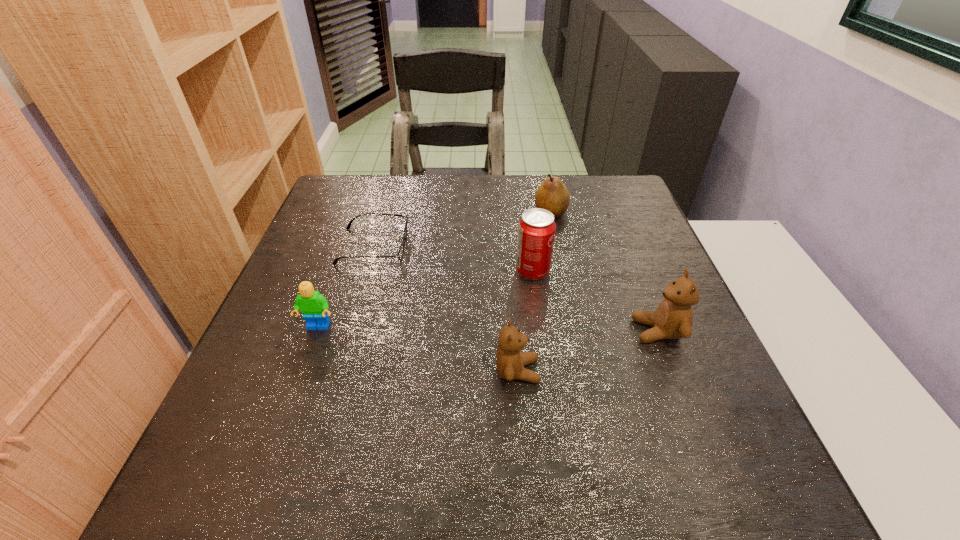
You are a GUI agent. You are given a task and a screenshot of the screen. Output one action in this format:
    pyautogui.click(x=<x>, y=<y>)
    Task: Click on the free region at the far edge of the desktop
    This screenshot has height=540, width=960.
    Given the screenshot: What is the action you would take?
    pyautogui.click(x=455, y=217)

The image size is (960, 540). Identify the location of free space at the near edge of the desktop. (384, 434).

Image resolution: width=960 pixels, height=540 pixels. In the image, there is a desktop. In order to click on free region at the left edge in this screenshot , I will do tap(358, 239).

Image resolution: width=960 pixels, height=540 pixels. Identify the location of free space at the right edge of the desktop. (604, 275).

In the image, there is a desktop. Where is `vacant space at the far left corner`? vacant space at the far left corner is located at coordinates click(378, 189).

I want to click on vacant space at the far right corner of the desktop, so click(x=585, y=214).

This screenshot has width=960, height=540. In order to click on empty space that is in between the shorter teddy bear and the taller teddy bear in this screenshot , I will do `click(588, 351)`.

Locate an element on the screen. Image resolution: width=960 pixels, height=540 pixels. free space between the Lego and the shorter teddy bear is located at coordinates (418, 349).

Identify the location of free space between the shorter teddy bear and the taller teddy bear. (588, 351).

I want to click on vacant space that's between the soda and the spectacles, so pos(453,259).